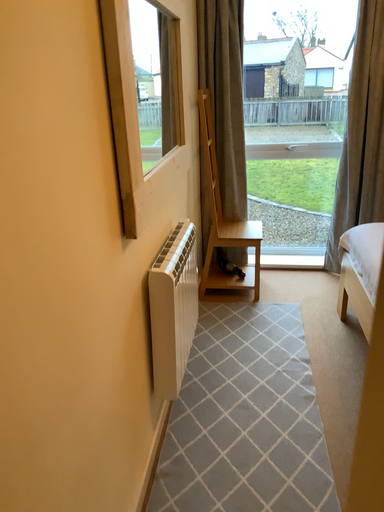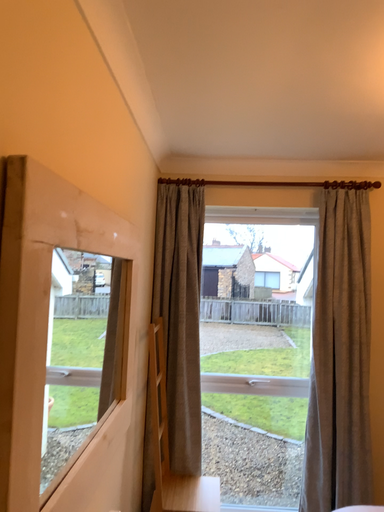
Question: How did the camera likely rotate when shooting the video?

Choices:
 (A) rotated right
 (B) rotated left

Answer: (A)